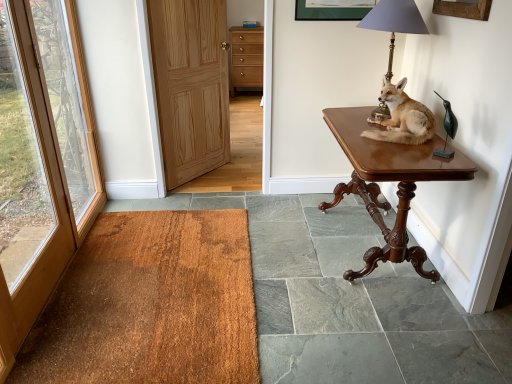
Find the location of a particular element. Image resolution: width=512 pixels, height=384 pixels. vacant space that's between brown wood table at right and brown textured mat at lower left is located at coordinates (302, 275).